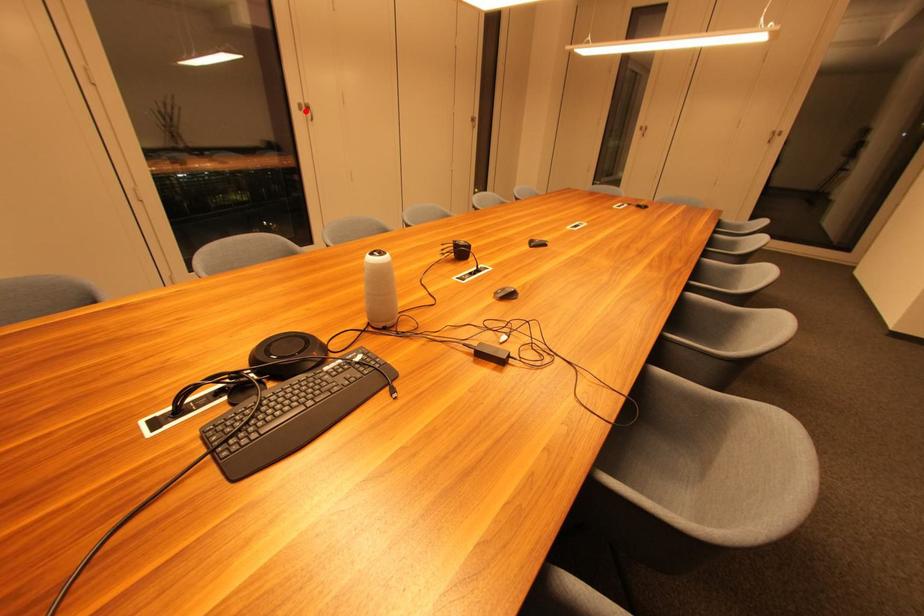
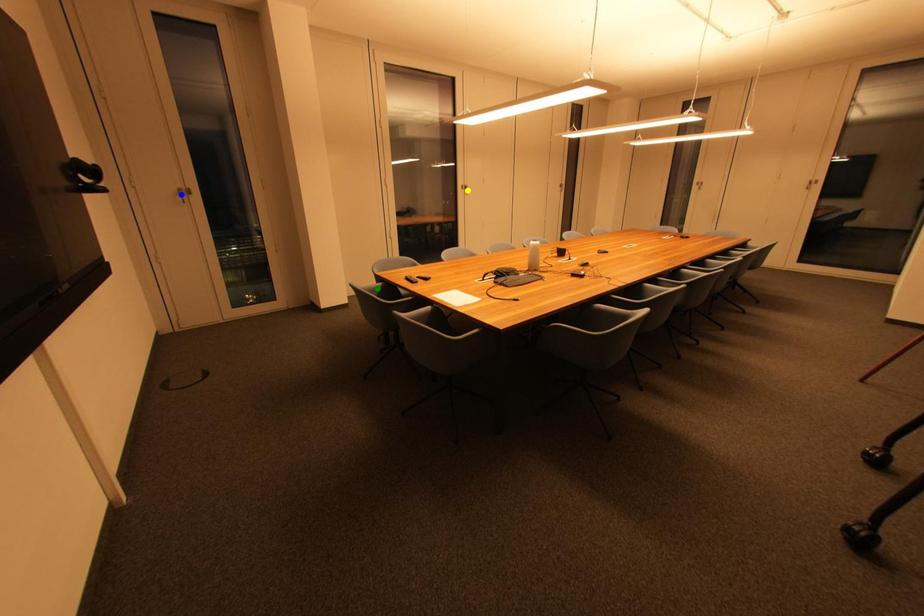
Question: I am providing you with two images of the same scene from different viewpoints. A red point is marked on the first image. You are given multiple points on the second image. Which spot in image 2 lines up with the point in image 1?

Choices:
 (A) yellow point
 (B) green point
 (C) blue point

Answer: (A)